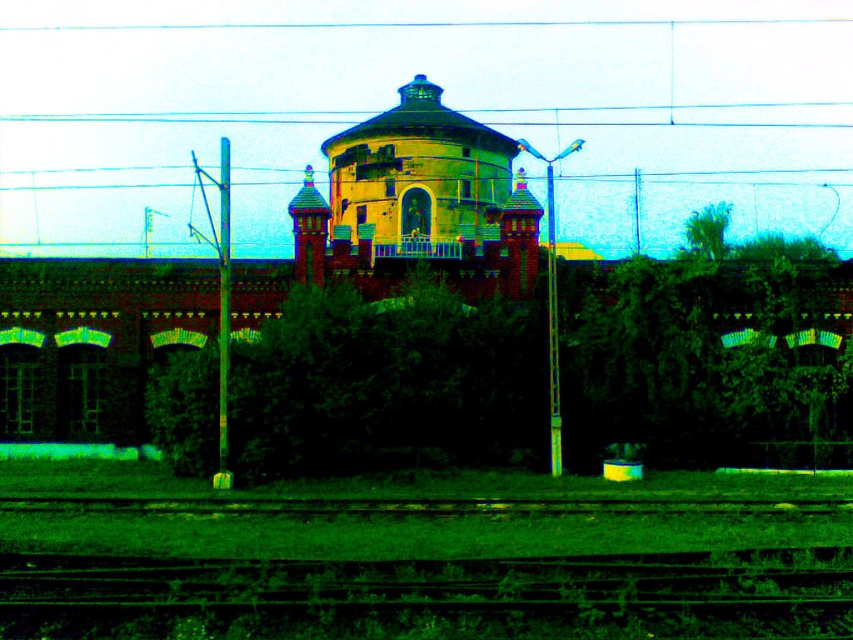
Who is shorter, green grassy train track at lower center or yellow brick water tower at center?

green grassy train track at lower center

Between green grassy train track at lower center and yellow brick water tower at center, which one has more height?

Standing taller between the two is yellow brick water tower at center.

What are the coordinates of `green grassy train track at lower center` in the screenshot? It's located at (433, 595).